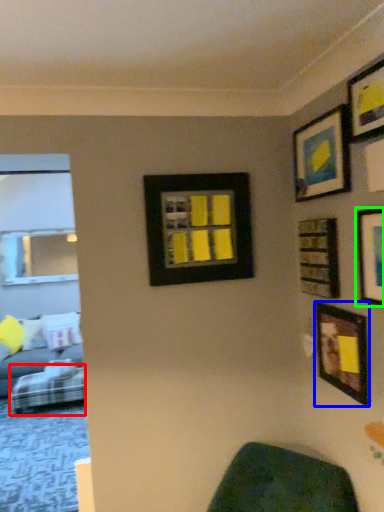
Question: Considering the real-world distances, which object is closest to furniture (highlighted by a red box)? picture frame (highlighted by a blue box) or picture frame (highlighted by a green box).

Choices:
 (A) picture frame
 (B) picture frame

Answer: (A)